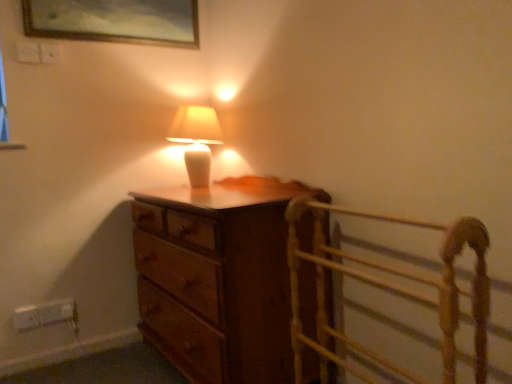
Describe the element at coordinates (390, 290) in the screenshot. I see `wooden bed frame at right` at that location.

The height and width of the screenshot is (384, 512). I want to click on white plastic electric outlet at lower left, arranged as the second electric outlet when viewed from the left, so click(57, 312).

Identify the location of matte white lamp at center. This screenshot has width=512, height=384. (196, 140).

At what (x,y) coordinates should I click in order to perform the action: click on gold-framed painting at upper center. Please return your answer as a coordinate pair (x, y). This screenshot has height=384, width=512. Looking at the image, I should click on (114, 21).

Identify the location of bed frame in front of the wooden chest of drawers at center. (390, 290).

Which of these two, wooden chest of drawers at center or wooden bed frame at right, stands shorter?

wooden bed frame at right is shorter.

Is wooden chest of drawers at center surrounding wooden bed frame at right?

No, wooden bed frame at right is not inside wooden chest of drawers at center.

Is wooden chest of drawers at center in contact with wooden bed frame at right?

wooden chest of drawers at center and wooden bed frame at right are not in contact.

Does white plastic electric outlet at lower left, marked as the second electric outlet in a right-to-left arrangement, have a larger size compared to wooden bed frame at right?

Incorrect, white plastic electric outlet at lower left, marked as the second electric outlet in a right-to-left arrangement, is not larger than wooden bed frame at right.

Image resolution: width=512 pixels, height=384 pixels. What are the coordinates of `the 2nd electric outlet to the left of the wooden bed frame at right, starting your count from the anchor` in the screenshot? It's located at (26, 318).

From the image's perspective, does white plastic electric outlet at lower left, marked as the second electric outlet in a right-to-left arrangement, appear lower than wooden bed frame at right?

Yes, from the image's perspective, white plastic electric outlet at lower left, marked as the second electric outlet in a right-to-left arrangement, is below wooden bed frame at right.

Is white plastic electric outlet at lower left, the first electric outlet from the left, wider than wooden bed frame at right?

No.

Is point (187, 140) less distant than point (295, 215)?

That is False.

From a real-world perspective, which is physically below, matte white lamp at center or wooden bed frame at right?

wooden bed frame at right is physically lower.

From a real-world perspective, who is located lower, matte white lamp at center or gold-framed painting at upper center?

matte white lamp at center.

Looking at this image, based on their positions, is matte white lamp at center located to the left or right of gold-framed painting at upper center?

In the image, matte white lamp at center appears on the right side of gold-framed painting at upper center.

Which object is wider, matte white lamp at center or gold-framed painting at upper center?

matte white lamp at center.

Based on the photo, measure the distance between matte white lamp at center and gold-framed painting at upper center.

The distance of matte white lamp at center from gold-framed painting at upper center is 20.48 inches.

From a real-world perspective, count 1st electric outlets downward from the matte white lamp at center and point to it. Please provide its 2D coordinates.

[(26, 318)]

Is white plastic electric outlet at lower left, marked as the second electric outlet in a right-to-left arrangement, bigger than matte white lamp at center?

No, white plastic electric outlet at lower left, marked as the second electric outlet in a right-to-left arrangement, is not bigger than matte white lamp at center.

Is white plastic electric outlet at lower left, marked as the second electric outlet in a right-to-left arrangement, oriented away from matte white lamp at center?

No, white plastic electric outlet at lower left, marked as the second electric outlet in a right-to-left arrangement,'s orientation is not away from matte white lamp at center.

From the picture: Considering the sizes of objects white plastic electric outlet at lower left, positioned as the 1th electric outlet in right-to-left order, and wooden bed frame at right in the image provided, who is taller, white plastic electric outlet at lower left, positioned as the 1th electric outlet in right-to-left order, or wooden bed frame at right?

Standing taller between the two is wooden bed frame at right.

Is white plastic electric outlet at lower left, arranged as the second electric outlet when viewed from the left, facing away from wooden bed frame at right?

white plastic electric outlet at lower left, arranged as the second electric outlet when viewed from the left, does not have its back to wooden bed frame at right.

Which of these two, gold-framed painting at upper center or white plastic electric outlet at lower left, marked as the second electric outlet in a right-to-left arrangement, is smaller?

With smaller size is white plastic electric outlet at lower left, marked as the second electric outlet in a right-to-left arrangement.

Which object is thinner, gold-framed painting at upper center or white plastic electric outlet at lower left, marked as the second electric outlet in a right-to-left arrangement?

With smaller width is white plastic electric outlet at lower left, marked as the second electric outlet in a right-to-left arrangement.

Is gold-framed painting at upper center spatially inside white plastic electric outlet at lower left, the first electric outlet from the left, or outside of it?

gold-framed painting at upper center cannot be found inside white plastic electric outlet at lower left, the first electric outlet from the left.

From the image's perspective, which one is positioned lower, gold-framed painting at upper center or white plastic electric outlet at lower left, marked as the second electric outlet in a right-to-left arrangement?

white plastic electric outlet at lower left, marked as the second electric outlet in a right-to-left arrangement, is shown below in the image.

This screenshot has width=512, height=384. I want to click on bed frame below the wooden chest of drawers at center (from a real-world perspective), so click(390, 290).

From the image's perspective, which electric outlet is the 2nd one below the wooden bed frame at right? Please provide its 2D coordinates.

[(26, 318)]

Based on their spatial positions, is wooden chest of drawers at center or white plastic electric outlet at lower left, the first electric outlet from the left, further from wooden bed frame at right?

white plastic electric outlet at lower left, the first electric outlet from the left, is positioned further to the anchor wooden bed frame at right.

Estimate the real-world distances between objects in this image. Which object is further from matte white lamp at center, gold-framed painting at upper center or white plastic electric outlet at lower left, arranged as the second electric outlet when viewed from the left?

white plastic electric outlet at lower left, arranged as the second electric outlet when viewed from the left, lies further to matte white lamp at center than the other object.

Looking at the image, which one is located closer to wooden bed frame at right, wooden chest of drawers at center or gold-framed painting at upper center?

wooden chest of drawers at center.

From the image, which object appears to be nearer to wooden bed frame at right, matte white lamp at center or gold-framed painting at upper center?

The object closer to wooden bed frame at right is matte white lamp at center.

Looking at the image, which one is located closer to white plastic electric outlet at lower left, the first electric outlet from the left, white plastic electric outlet at lower left, positioned as the 1th electric outlet in right-to-left order, or matte white lamp at center?

white plastic electric outlet at lower left, positioned as the 1th electric outlet in right-to-left order.

Looking at the image, which one is located further to white plastic electric outlet at lower left, marked as the second electric outlet in a right-to-left arrangement, matte white lamp at center or white plastic electric outlet at lower left, arranged as the second electric outlet when viewed from the left?

Based on the image, matte white lamp at center appears to be further to white plastic electric outlet at lower left, marked as the second electric outlet in a right-to-left arrangement.

Considering their positions, is white plastic electric outlet at lower left, marked as the second electric outlet in a right-to-left arrangement, positioned closer to matte white lamp at center than wooden chest of drawers at center?

wooden chest of drawers at center lies closer to matte white lamp at center than the other object.

From the image, which object appears to be farther from white plastic electric outlet at lower left, arranged as the second electric outlet when viewed from the left, white plastic electric outlet at lower left, marked as the second electric outlet in a right-to-left arrangement, or matte white lamp at center?

matte white lamp at center lies further to white plastic electric outlet at lower left, arranged as the second electric outlet when viewed from the left, than the other object.

Locate an element on the screen. The width and height of the screenshot is (512, 384). electric outlet located between white plastic electric outlet at lower left, marked as the second electric outlet in a right-to-left arrangement, and wooden bed frame at right in the left-right direction is located at coordinates click(57, 312).

Locate an element on the screen. lamp between gold-framed painting at upper center and wooden bed frame at right vertically is located at coordinates (196, 140).

In order to click on the chest of drawers between gold-framed painting at upper center and white plastic electric outlet at lower left, the first electric outlet from the left, vertically in this screenshot , I will do `click(218, 279)`.

I want to click on lamp between wooden bed frame at right and white plastic electric outlet at lower left, positioned as the 1th electric outlet in right-to-left order, from front to back, so click(x=196, y=140).